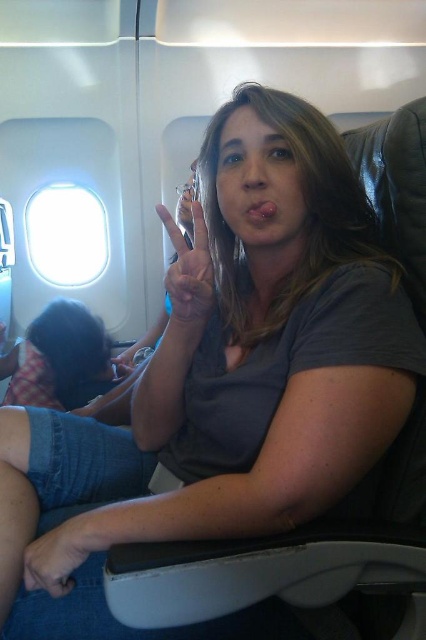
Question: Which object is farther from the camera taking this photo?

Choices:
 (A) matte silver ring at center
 (B) transparent glass airplane window at upper left

Answer: (B)

Question: In this image, where is transparent glass airplane window at upper left located relative to matte silver ring at center?

Choices:
 (A) below
 (B) above

Answer: (B)

Question: Is transparent glass airplane window at upper left above matte silver ring at center?

Choices:
 (A) no
 (B) yes

Answer: (B)

Question: Does transparent glass airplane window at upper left appear under matte silver ring at center?

Choices:
 (A) yes
 (B) no

Answer: (B)

Question: Which point appears farthest from the camera in this image?

Choices:
 (A) (169, 220)
 (B) (77, 272)

Answer: (B)

Question: Which object is farther from the camera taking this photo?

Choices:
 (A) transparent glass airplane window at upper left
 (B) matte silver ring at center

Answer: (A)